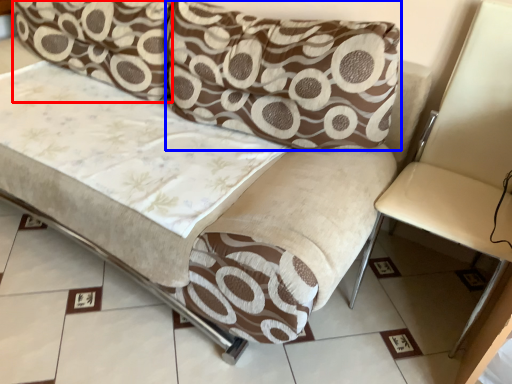
Question: Among these objects, which one is farthest to the camera, pillow (highlighted by a red box) or pillow (highlighted by a blue box)?

Choices:
 (A) pillow
 (B) pillow

Answer: (A)